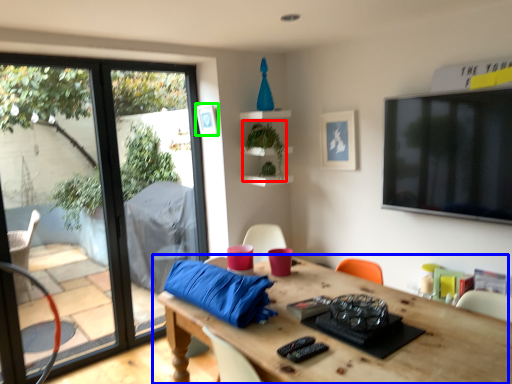
Question: Which is nearer to the plant (highlighted by a red box)? table (highlighted by a blue box) or picture frame (highlighted by a green box).

Choices:
 (A) table
 (B) picture frame

Answer: (B)